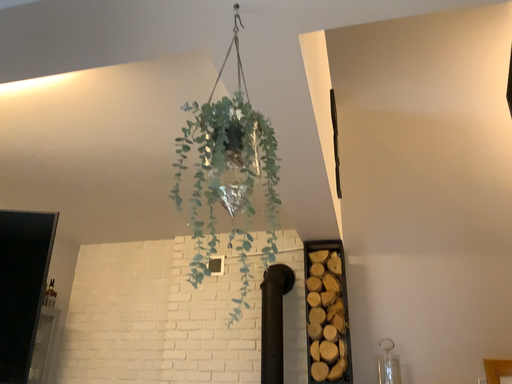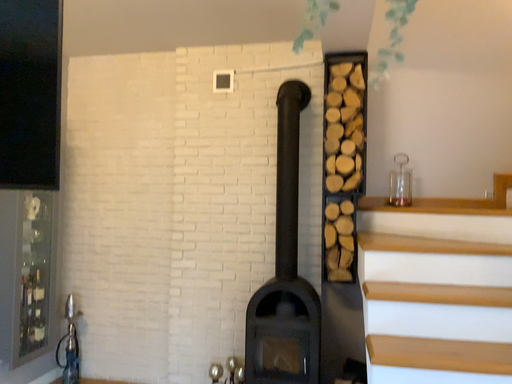
Question: Which way did the camera rotate in the video?

Choices:
 (A) rotated upward
 (B) rotated downward

Answer: (B)